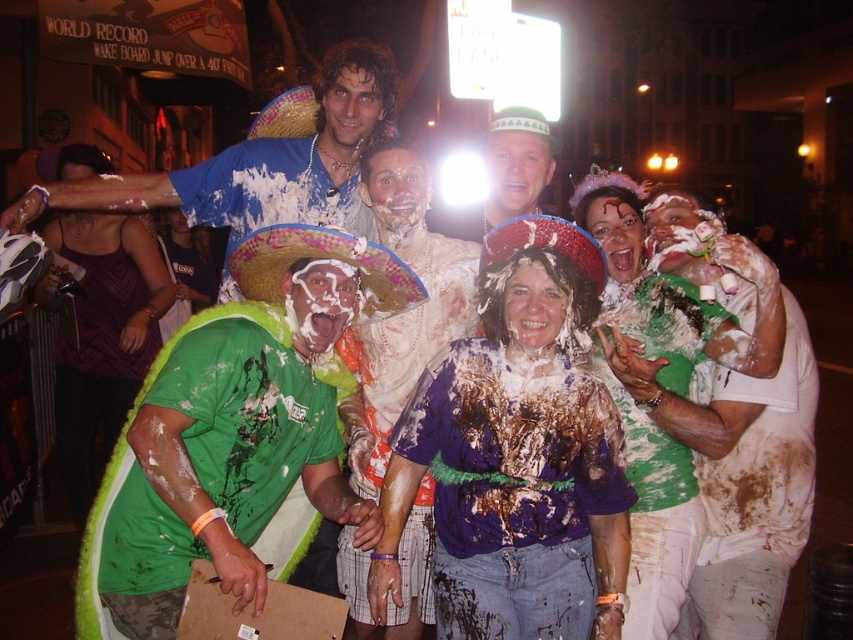
You are a photographer standing at the origin point of the image coordinate system. You want to capture a closeup shot of the white painted shirt at center. What are the coordinates where you should focus your camera?

The coordinates to focus on are at point (744,481).

You are standing at the camera position and want to throw a napkin to the person wearing the white painted shirt at center. The napkin can travel 10 feet. Will it reach them?

The distance between you and the white painted shirt at center is 10.38 feet, which is slightly farther than the napkin can travel. The napkin will not reach them.